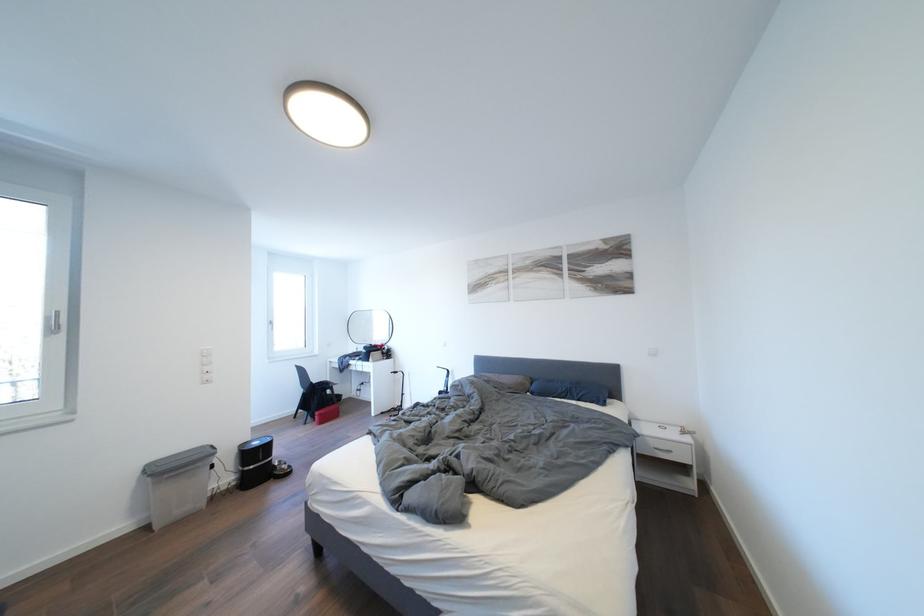
Find where to clip the grey bin handle. Please return your answer as a coordinate pair (x, y).

(663, 448)